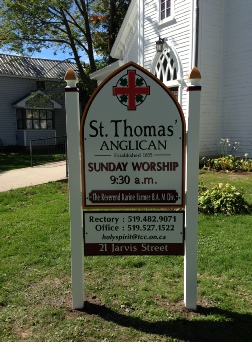
Image resolution: width=252 pixels, height=342 pixels. Identify the location of metallic railing. (31, 147).